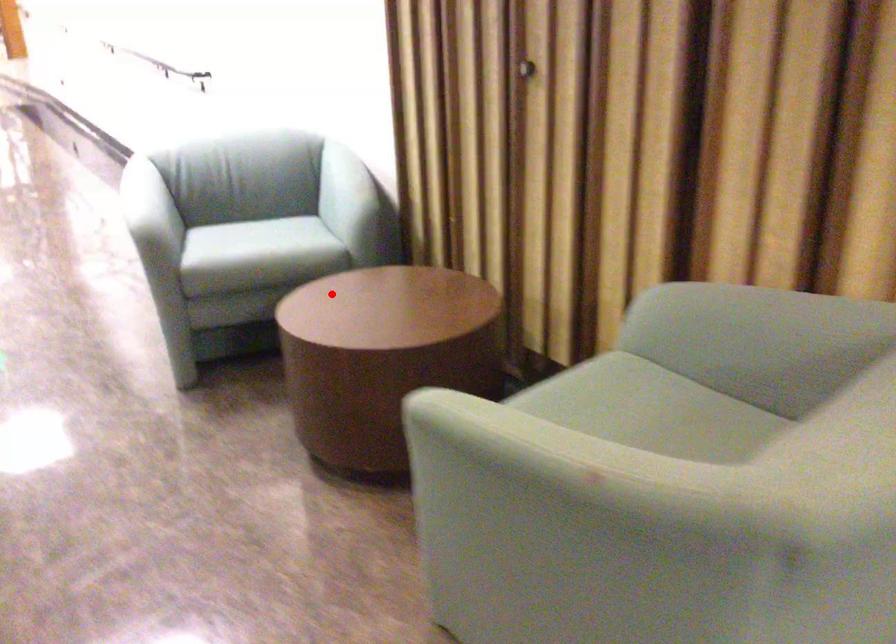
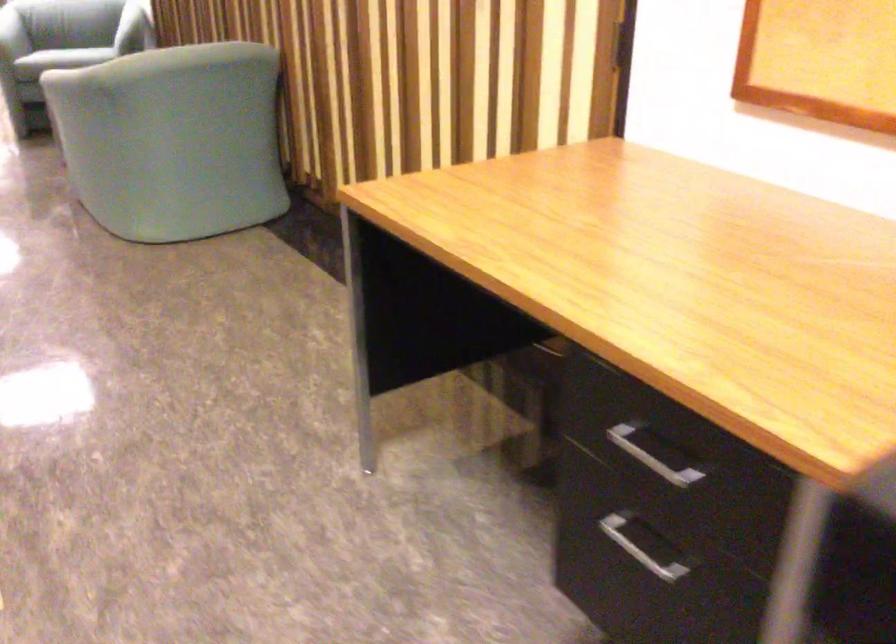
Question: I am providing you with two images of the same scene from different viewpoints. A red point is shown in image1. For the corresponding object point in image2, is it positioned nearer or farther from the camera?

Choices:
 (A) Nearer
 (B) Farther

Answer: (B)